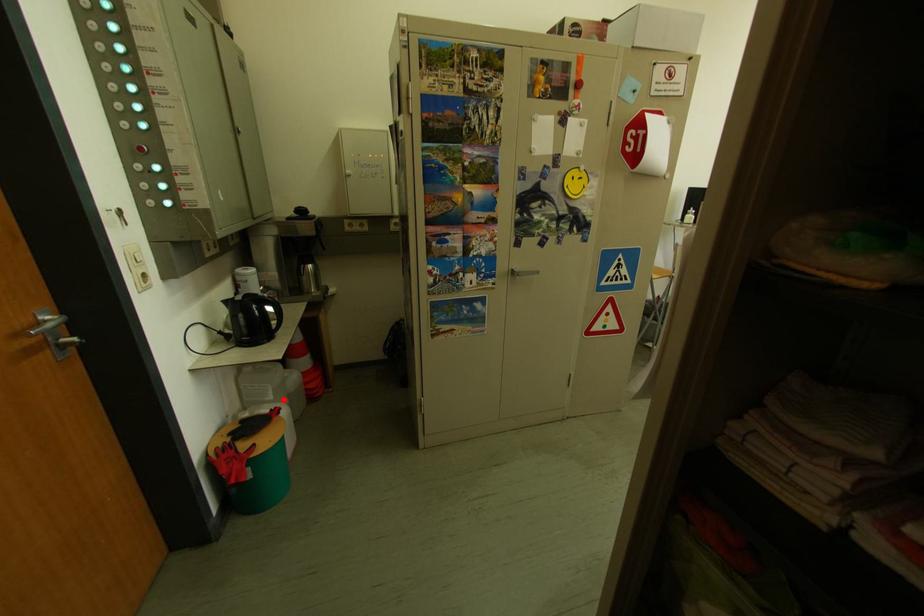
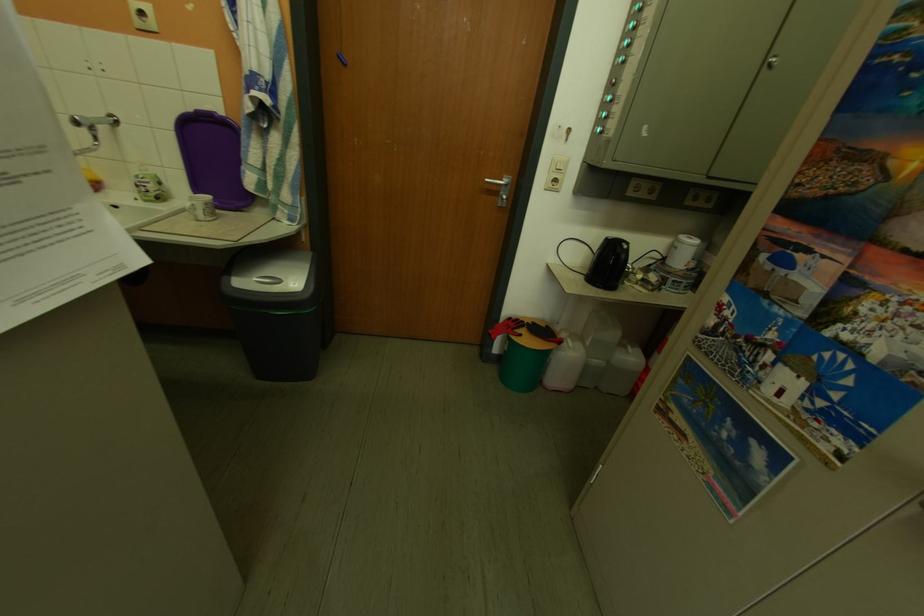
Locate, in the second image, the point that corresponds to the highlighted location in the first image.

(602, 346)